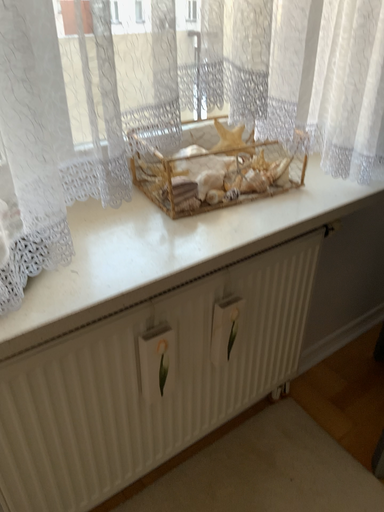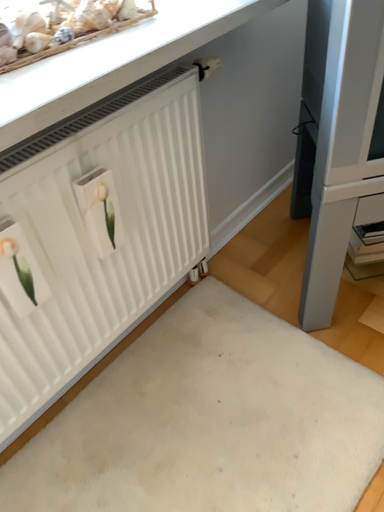
Question: How did the camera likely rotate when shooting the video?

Choices:
 (A) rotated downward
 (B) rotated upward

Answer: (A)